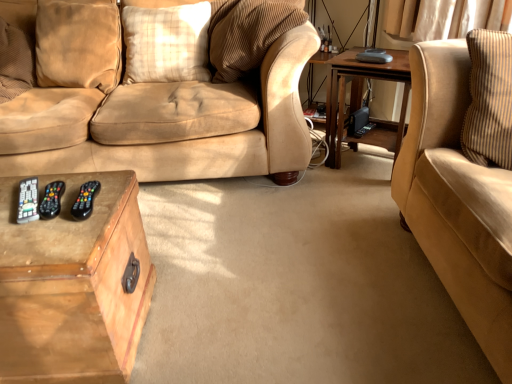
Question: Can you confirm if suede beige couch at right is smaller than wooden table at right, the second table viewed from the front?

Choices:
 (A) no
 (B) yes

Answer: (A)

Question: Can we say suede beige couch at right lies outside wooden table at right, which appears as the 2th table when ordered from the bottom?

Choices:
 (A) yes
 (B) no

Answer: (A)

Question: From a real-world perspective, is suede beige couch at right over wooden table at right, the second table viewed from the front?

Choices:
 (A) no
 (B) yes

Answer: (B)

Question: Would you say suede beige couch at right contains wooden table at right, which appears as the 2th table when ordered from the bottom?

Choices:
 (A) yes
 (B) no

Answer: (B)

Question: Is suede beige couch at right turned away from wooden table at right, the 1th table viewed from the back?

Choices:
 (A) no
 (B) yes

Answer: (A)

Question: Is plaid fabric pillow at center, which is counted as the 1th pillow, starting from the right, to the left or to the right of velvet beige pillow at upper left, acting as the 2th pillow starting from the right, in the image?

Choices:
 (A) left
 (B) right

Answer: (B)

Question: Considering the positions of plaid fabric pillow at center, the second pillow positioned from the left, and velvet beige pillow at upper left, acting as the 2th pillow starting from the right, in the image, is plaid fabric pillow at center, the second pillow positioned from the left, wider or thinner than velvet beige pillow at upper left, acting as the 2th pillow starting from the right,?

Choices:
 (A) wide
 (B) thin

Answer: (A)

Question: From a real-world perspective, is plaid fabric pillow at center, the second pillow positioned from the left, above or below velvet beige pillow at upper left, arranged as the 1th pillow when viewed from the left?

Choices:
 (A) below
 (B) above

Answer: (A)

Question: Considering the positions of plaid fabric pillow at center, the second pillow positioned from the left, and velvet beige pillow at upper left, acting as the 2th pillow starting from the right, in the image, is plaid fabric pillow at center, the second pillow positioned from the left, taller or shorter than velvet beige pillow at upper left, acting as the 2th pillow starting from the right,?

Choices:
 (A) short
 (B) tall

Answer: (A)

Question: Based on their sizes in the image, would you say black plastic remote at lower left is bigger or smaller than wooden table at right, the 1th table positioned from the right?

Choices:
 (A) small
 (B) big

Answer: (A)

Question: Does point (30, 203) appear closer or farther from the camera than point (358, 66)?

Choices:
 (A) farther
 (B) closer

Answer: (B)

Question: In terms of width, does black plastic remote at lower left look wider or thinner when compared to wooden table at right, which is counted as the 1th table, starting from the top?

Choices:
 (A) wide
 (B) thin

Answer: (B)

Question: Is black plastic remote at lower left in front of or behind wooden table at right, which appears as the 2th table when ordered from the bottom, in the image?

Choices:
 (A) front
 (B) behind

Answer: (A)

Question: Is wooden trunk at lower left, acting as the second table starting from the top, taller or shorter than wooden table at right, the 1th table viewed from the back?

Choices:
 (A) short
 (B) tall

Answer: (A)

Question: From a real-world perspective, is wooden trunk at lower left, the 1th table from the left, above or below wooden table at right, the second table positioned from the left?

Choices:
 (A) below
 (B) above

Answer: (A)